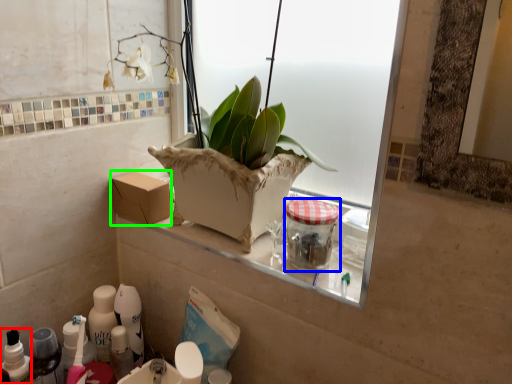
Question: Which object is positioned farthest from toiletry (highlighted by a red box)? Select from glass jar (highlighted by a blue box) and cardboard box (highlighted by a green box).

Choices:
 (A) glass jar
 (B) cardboard box

Answer: (A)